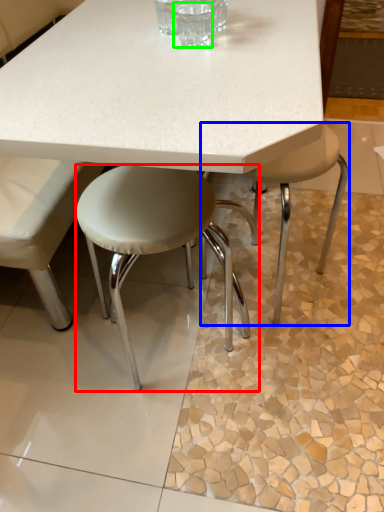
Question: Considering the real-world distances, which object is closest to stool (highlighted by a red box)? stool (highlighted by a blue box) or clear (highlighted by a green box).

Choices:
 (A) stool
 (B) clear

Answer: (B)